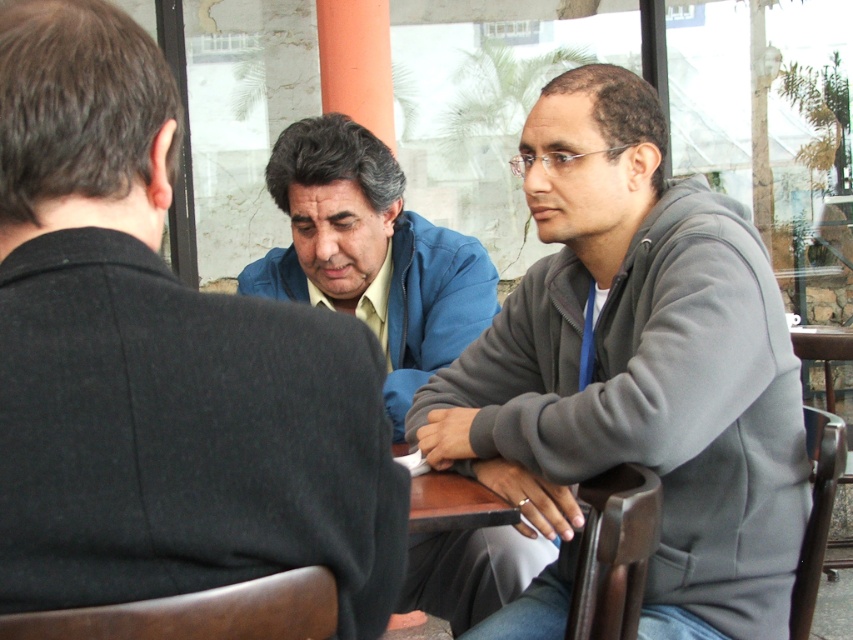
Which is above, blue matte jacket at center or brown wooden table at center?

Positioned higher is blue matte jacket at center.

Does blue matte jacket at center have a greater height compared to brown wooden table at center?

Yes.

The image size is (853, 640). Identify the location of blue matte jacket at center. (370, 253).

Who is shorter, gray fleece jacket at center or blue matte jacket at center?

With less height is blue matte jacket at center.

Does point (677, 413) come farther from viewer compared to point (399, 333)?

No, it is in front of (399, 333).

Where is `gray fleece jacket at center`? This screenshot has width=853, height=640. gray fleece jacket at center is located at coordinates (641, 360).

Identify the location of gray fleece jacket at center. tap(641, 360).

Can you confirm if blue fabric shirt at center is positioned to the right of gray fleece jacket at center?

No, blue fabric shirt at center is not to the right of gray fleece jacket at center.

Can you confirm if blue fabric shirt at center is positioned above gray fleece jacket at center?

No, blue fabric shirt at center is not above gray fleece jacket at center.

Does point (209, 380) come behind point (611, 266)?

No, it is in front of (611, 266).

At what (x,y) coordinates should I click in order to perform the action: click on blue fabric shirt at center. Please return your answer as a coordinate pair (x, y). Looking at the image, I should click on (160, 364).